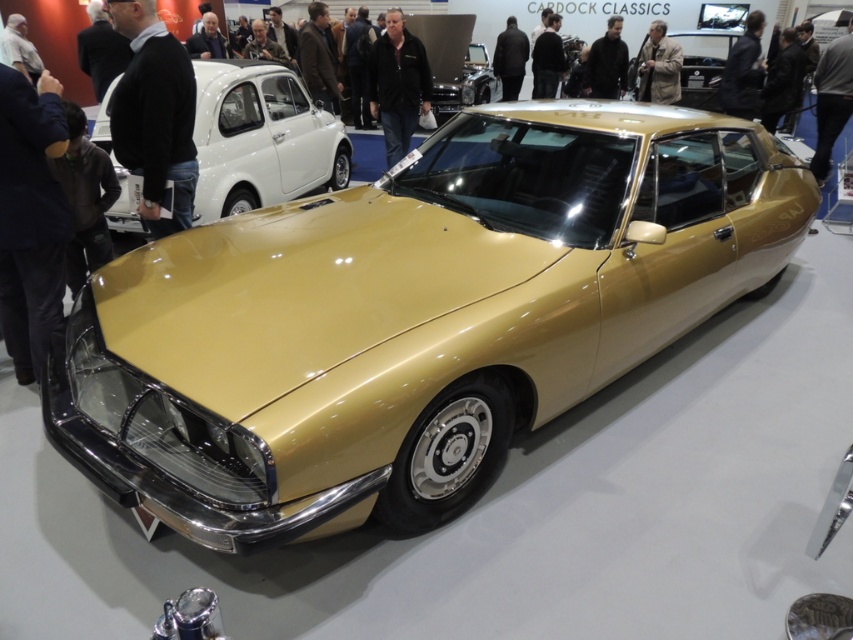
You are standing at the entrance of the classic car exhibition and see the dark blue jacket at center and the gray hair at upper center. If you want to take a photo of both in the same frame, will you need to zoom in or zoom out your camera?

The dark blue jacket at center is 5.54 meters away from gray hair at upper center. To capture both in the same frame, you need to zoom out to widen the field of view since they are more than 5 meters apart.

You are a photographer at the classic car exhibition. You want to take a photo of the gold metallic car at center and the brown leather jacket at center together in the frame. Is there enough space between them for both to fit in the photo?

The gold metallic car at center and brown leather jacket at center are 2.38 meters apart. Since the distance between them is manageable, both objects can likely fit within the frame of a standard camera shot, provided the photographer adjusts the zoom or position accordingly.

You are standing at the entrance of the classic car exhibition and want to take a photo of the Citroen SM. There are two points marked on the car, point (825, 152) and point (549, 80). Which point is closer to you?

Point (825, 152) is closer to the camera than point (549, 80), so it is the point closer to you.